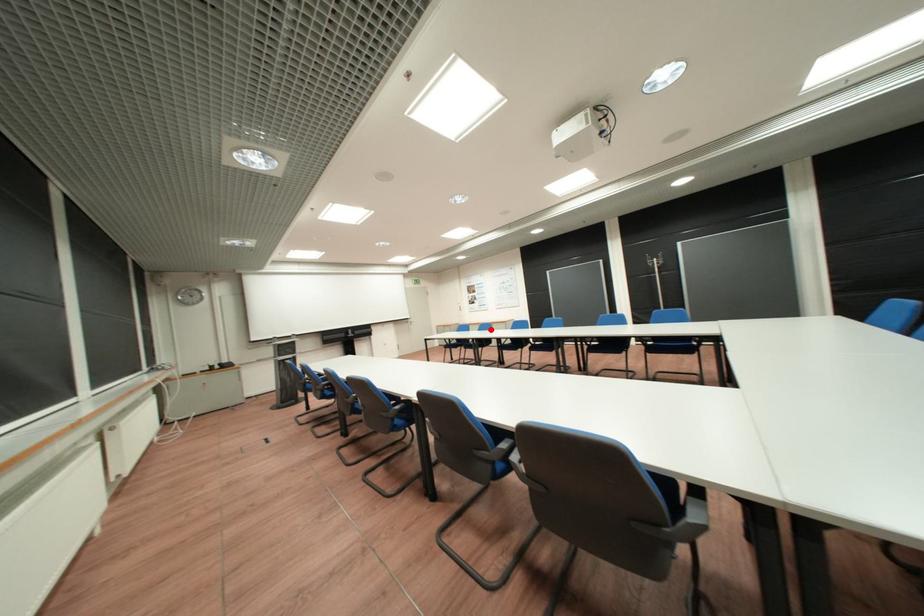
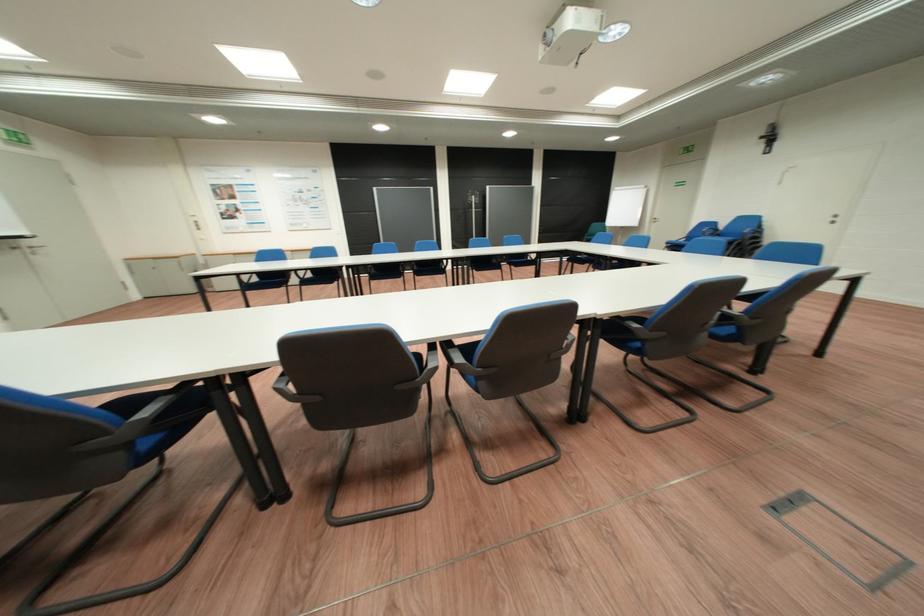
Find the pixel in the second image that matches the highlighted location in the first image.

(322, 254)